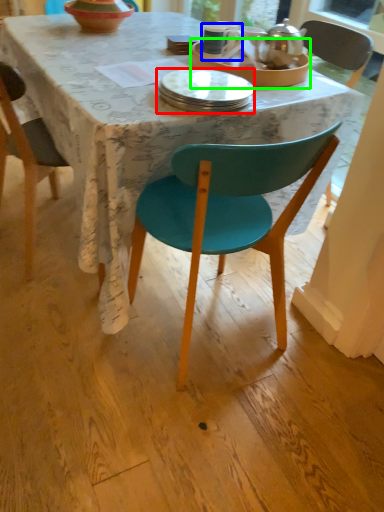
Question: Which object is the farthest from plate (highlighted by a red box)? Choose among these: coffee cup (highlighted by a blue box) or tableware (highlighted by a green box).

Choices:
 (A) coffee cup
 (B) tableware

Answer: (A)